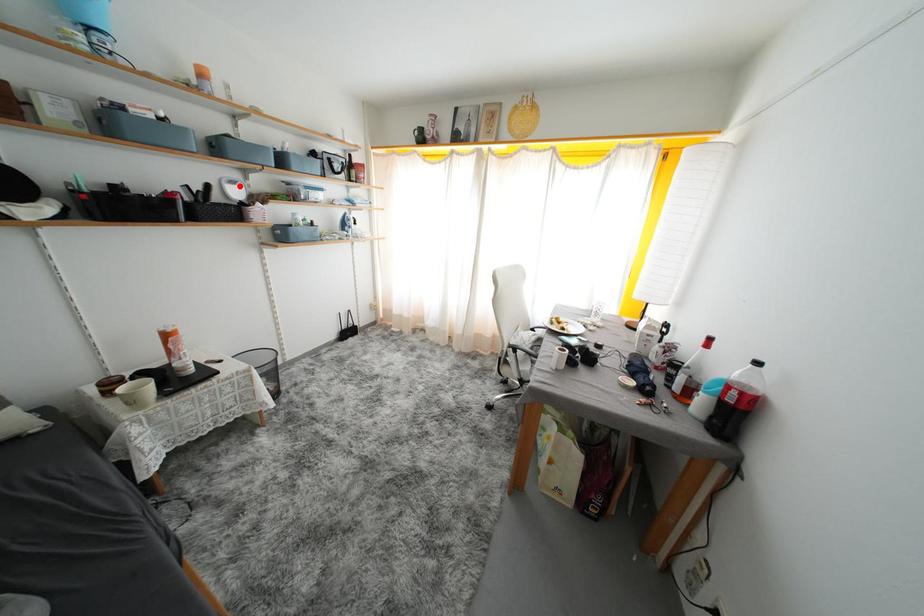
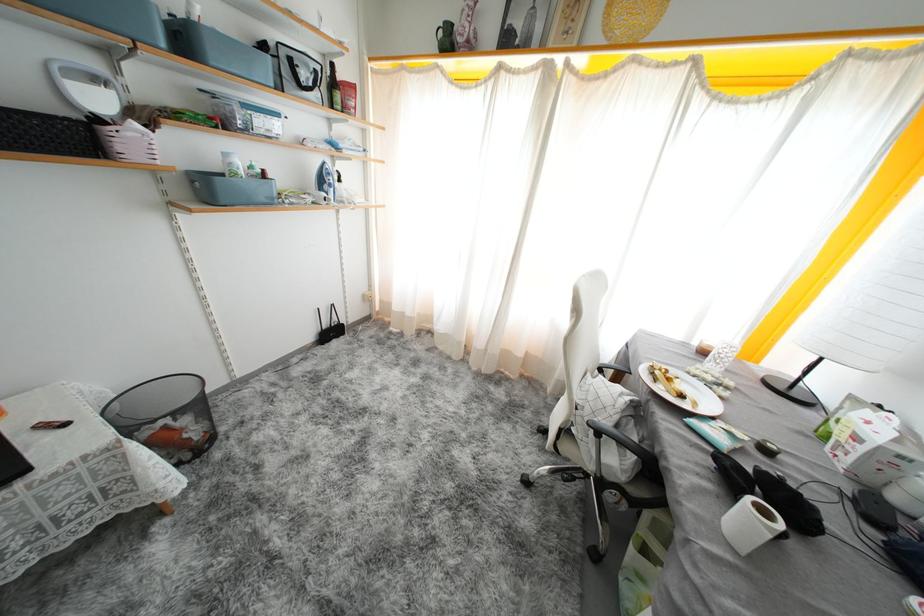
In the second image, find the point that corresponds to the highlighted location in the first image.

(103, 84)